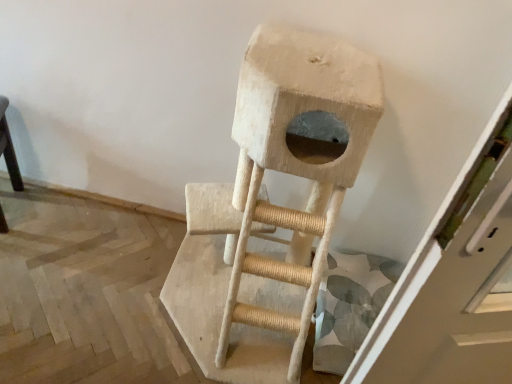
Find the location of a particular element. Image resolution: width=512 pixels, height=384 pixels. vacant space to the right of smooth black table at left is located at coordinates [50, 220].